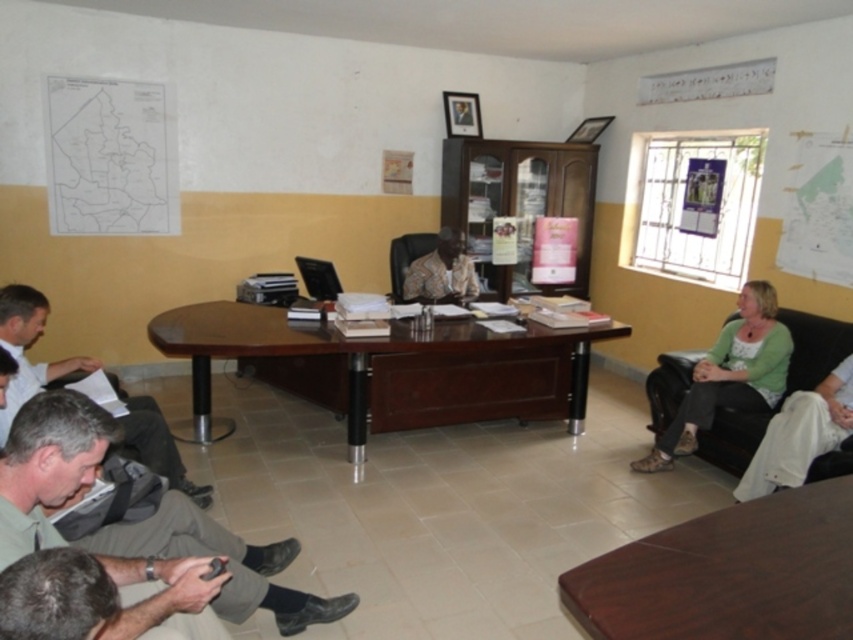
Does brown wooden table at lower right lie in front of white fabric shirt at lower left?

That is True.

Can you confirm if brown wooden table at lower right is smaller than white fabric shirt at lower left?

Yes, brown wooden table at lower right is smaller than white fabric shirt at lower left.

Image resolution: width=853 pixels, height=640 pixels. Describe the element at coordinates (728, 573) in the screenshot. I see `brown wooden table at lower right` at that location.

Locate an element on the screen. This screenshot has width=853, height=640. brown wooden table at lower right is located at coordinates (728, 573).

Does dark brown polished wood round table at center have a larger size compared to patterned fabric shirt at center?

Yes, dark brown polished wood round table at center is bigger than patterned fabric shirt at center.

Between point (364, 438) and point (413, 266), which one is positioned in front?

Point (364, 438) is more forward.

Measure the distance between dark brown polished wood round table at center and camera.

dark brown polished wood round table at center and camera are 3.55 meters apart from each other.

Locate an element on the screen. Image resolution: width=853 pixels, height=640 pixels. dark brown polished wood round table at center is located at coordinates (345, 355).

You are a GUI agent. You are given a task and a screenshot of the screen. Output one action in this format:
    pyautogui.click(x=<x>, y=<y>)
    Task: Click on the gray fabric pants at lower left
    The height and width of the screenshot is (640, 853).
    Given the screenshot: What is the action you would take?
    pyautogui.click(x=47, y=465)

Between point (148, 625) and point (838, 330), which one is positioned behind?

Positioned behind is point (838, 330).

Image resolution: width=853 pixels, height=640 pixels. What do you see at coordinates (47, 465) in the screenshot?
I see `gray fabric pants at lower left` at bounding box center [47, 465].

You are a GUI agent. You are given a task and a screenshot of the screen. Output one action in this format:
    pyautogui.click(x=<x>, y=<y>)
    Task: Click on the gray fabric pants at lower left
    This screenshot has width=853, height=640.
    Given the screenshot: What is the action you would take?
    tap(47, 465)